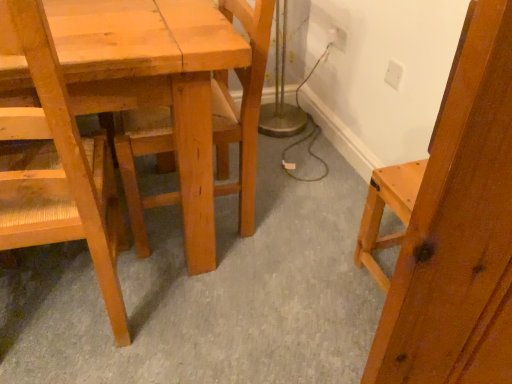
The image size is (512, 384). Identify the location of spots to the right of natural wood chair at left, acting as the first chair starting from the left. coord(190,308).